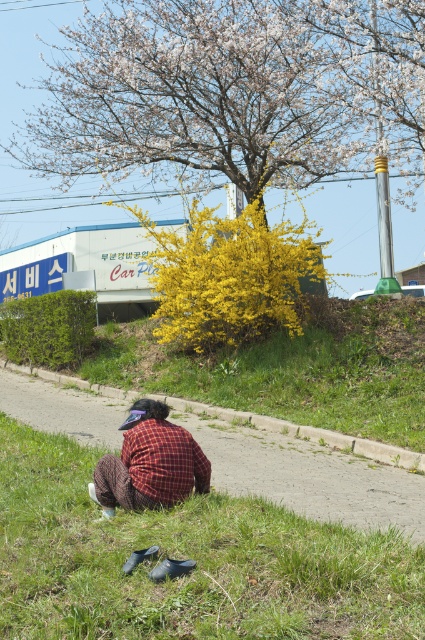
You are a photographer trying to capture the fluffy white blossoms at upper center and the plaid fabric shirt at lower center in the same frame. Based on their sizes, which object would appear bigger in your photo?

The fluffy white blossoms at upper center would appear bigger in the photo since they are larger in size compared to the plaid fabric shirt at lower center.

You are a gardener who needs to plant new flowers in the area. Which surface, the green grass at lower center or the gray concrete pavement at lower center, has more space available for planting?

The gray concrete pavement at lower center has more space available for planting since it occupies more area than the green grass at lower center.